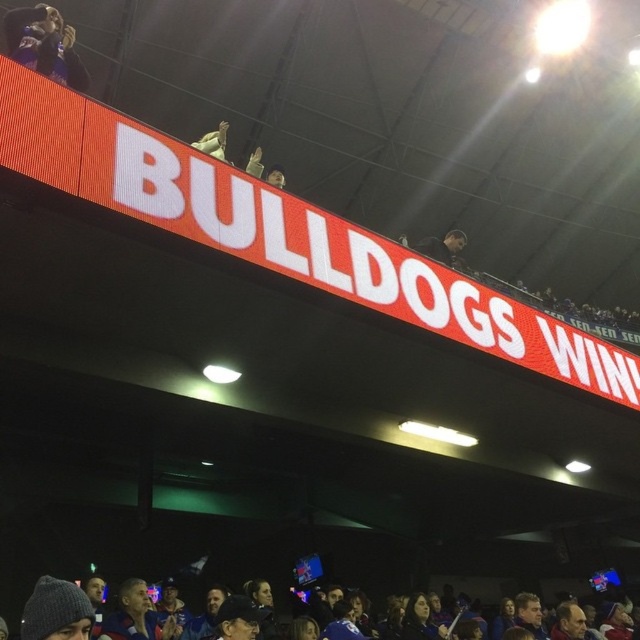
Question: Does dark fabric hoodie at upper left lie in front of gray knit cap at lower left?

Choices:
 (A) yes
 (B) no

Answer: (B)

Question: Does dark gray fabric jacket at upper center appear on the left side of matte white glove at upper center?

Choices:
 (A) no
 (B) yes

Answer: (A)

Question: Among these objects, which one is farthest from the camera?

Choices:
 (A) dark fabric hoodie at upper left
 (B) matte white glove at upper center
 (C) dark gray fabric jacket at upper center

Answer: (C)

Question: Is matte white glove at upper center further to camera compared to dark gray hoodie at center?

Choices:
 (A) yes
 (B) no

Answer: (B)

Question: Which point is closer to the camera?

Choices:
 (A) dark gray hoodie at center
 (B) matte white glove at upper center

Answer: (B)

Question: Which point is farther from the camera taking this photo?

Choices:
 (A) (22, 24)
 (B) (212, 141)

Answer: (B)